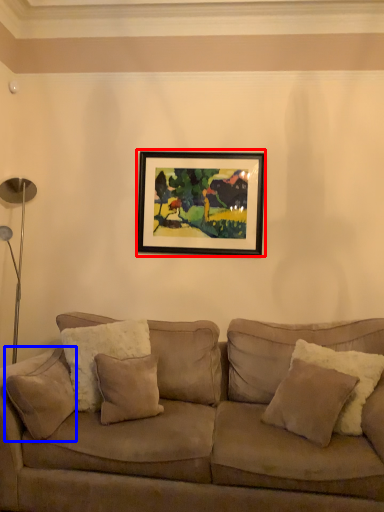
Question: Which of the following is the farthest to the observer, picture frame (highlighted by a red box) or pillow (highlighted by a blue box)?

Choices:
 (A) picture frame
 (B) pillow

Answer: (A)